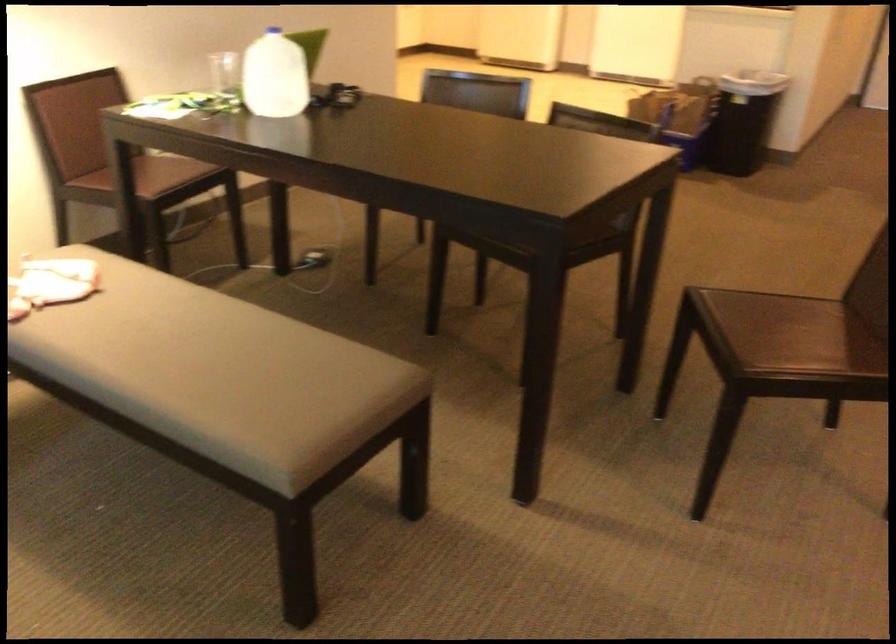
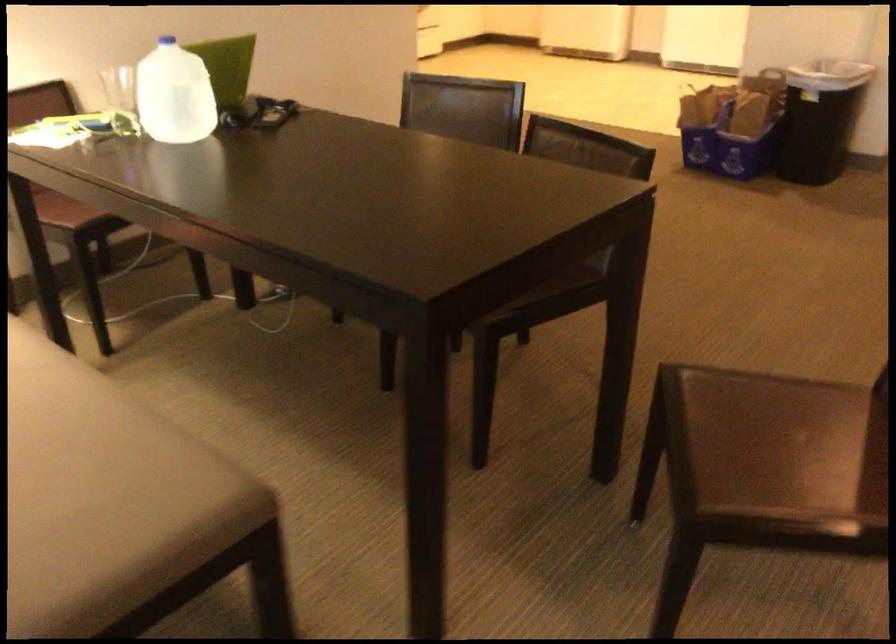
The point at (x=782, y=322) is marked in the first image. Where is the corresponding point in the second image?

(782, 430)